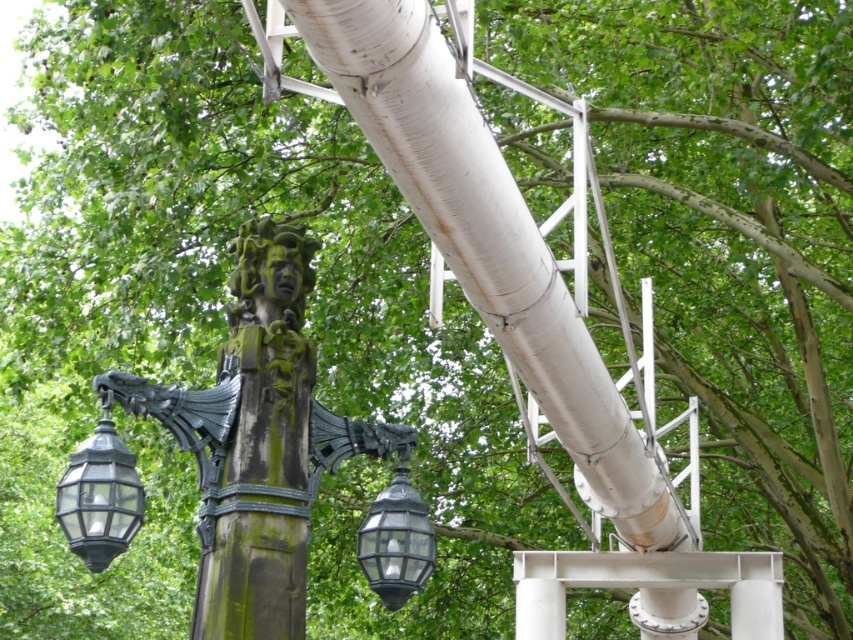
Which is below, matte black lantern at lower left or matte black lantern at lower center?

matte black lantern at lower center is lower down.

Which is in front, point (117, 547) or point (375, 572)?

Point (117, 547) is more forward.

Is point (90, 444) closer to viewer compared to point (401, 593)?

Yes, it is.

The height and width of the screenshot is (640, 853). What are the coordinates of `matte black lantern at lower left` in the screenshot? It's located at (99, 497).

Is green mossy stone sculpture at center below matte black lantern at lower center?

No, green mossy stone sculpture at center is not below matte black lantern at lower center.

Is green mossy stone sculpture at center taller than matte black lantern at lower center?

In fact, green mossy stone sculpture at center may be shorter than matte black lantern at lower center.

Who is more distant from viewer, (283, 586) or (416, 499)?

Positioned behind is point (416, 499).

What are the coordinates of `green mossy stone sculpture at center` in the screenshot? It's located at (238, 449).

What do you see at coordinates (238, 449) in the screenshot? I see `green mossy stone sculpture at center` at bounding box center [238, 449].

Between point (196, 432) and point (103, 452), which one is positioned behind?

Positioned behind is point (196, 432).

This screenshot has height=640, width=853. I want to click on green mossy stone sculpture at center, so click(x=238, y=449).